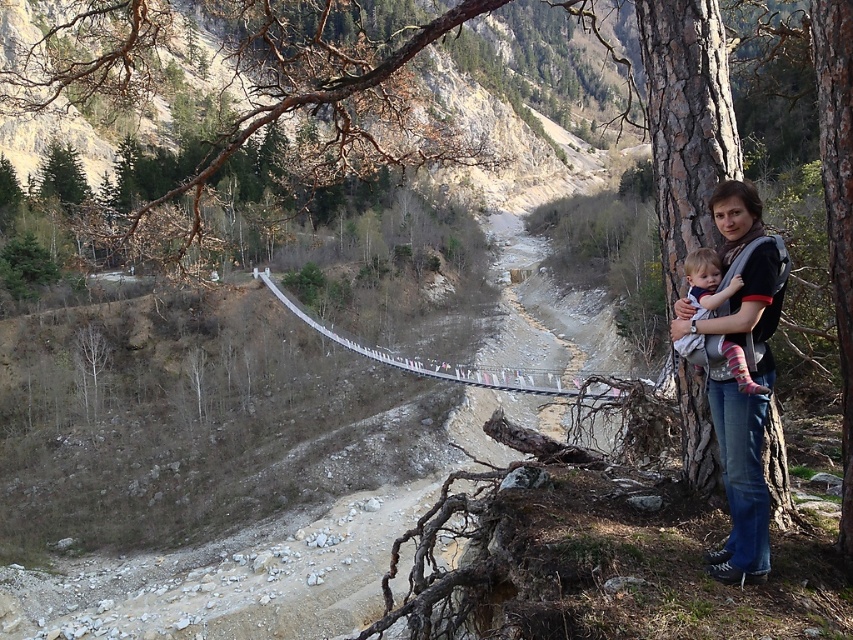
Question: Observing the image, what is the correct spatial positioning of denim jeans at right in reference to soft pink socks at right?

Choices:
 (A) right
 (B) left

Answer: (B)

Question: Which point is farther from the camera taking this photo?

Choices:
 (A) (675, 307)
 (B) (711, 252)

Answer: (A)

Question: From the image, what is the correct spatial relationship of denim jeans at right in relation to white fabric suspension bridge at center?

Choices:
 (A) above
 (B) below

Answer: (A)

Question: Based on their relative distances, which object is farther from the soft pink socks at right?

Choices:
 (A) white fabric suspension bridge at center
 (B) denim jeans at right

Answer: (A)

Question: Is denim jeans at right wider than soft pink socks at right?

Choices:
 (A) no
 (B) yes

Answer: (B)

Question: Among these objects, which one is farthest from the camera?

Choices:
 (A) soft pink socks at right
 (B) denim jeans at right

Answer: (A)